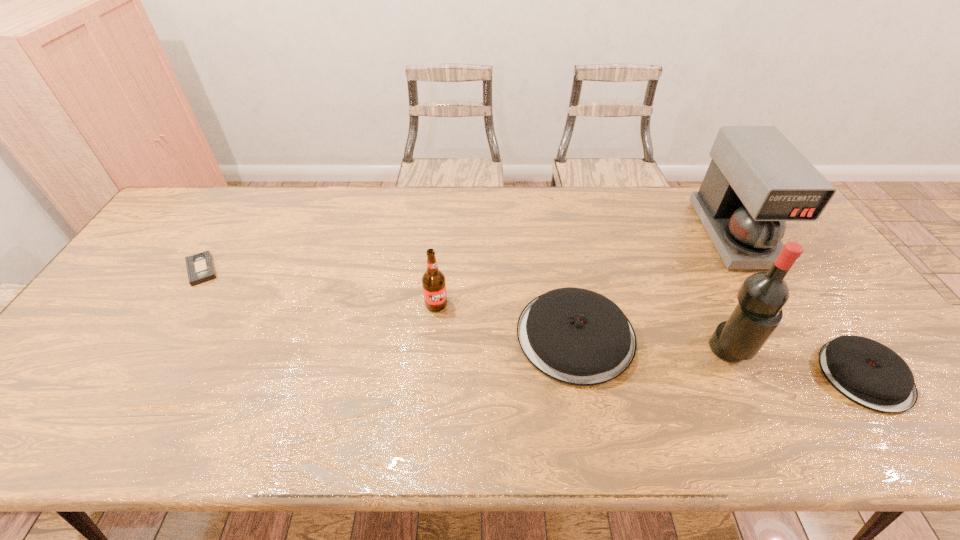
I want to click on the taller pancake, so click(x=576, y=336).

In order to click on the fourth tallest object in this screenshot , I will do `click(576, 336)`.

You are a GUI agent. You are given a task and a screenshot of the screen. Output one action in this format:
    pyautogui.click(x=<x>, y=<y>)
    Task: Click on the shorter pancake
    
    Given the screenshot: What is the action you would take?
    pyautogui.click(x=868, y=373)

You are a GUI agent. You are given a task and a screenshot of the screen. Output one action in this format:
    pyautogui.click(x=<x>, y=<y>)
    Task: Click on the right pancake
    This screenshot has height=540, width=960.
    Given the screenshot: What is the action you would take?
    pyautogui.click(x=868, y=373)

I want to click on the shortest object, so click(200, 268).

You are a GUI agent. You are given a task and a screenshot of the screen. Output one action in this format:
    pyautogui.click(x=<x>, y=<y>)
    Task: Click on the videotape
    
    Given the screenshot: What is the action you would take?
    pyautogui.click(x=200, y=268)

What are the coordinates of `the second tallest object` in the screenshot? It's located at (757, 180).

Find the location of a particular element. the tallest object is located at coordinates (762, 296).

At what (x,y) coordinates should I click in order to perform the action: click on wine bottle. Please return your answer as a coordinate pair (x, y). This screenshot has height=540, width=960. Looking at the image, I should click on pyautogui.click(x=762, y=296).

Image resolution: width=960 pixels, height=540 pixels. I want to click on the second object from left to right, so click(433, 280).